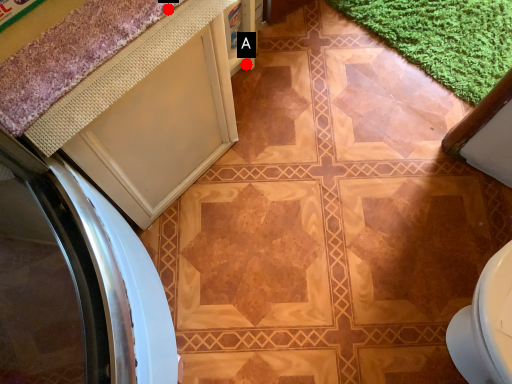
Question: Two points are circled on the image, labeled by A and B beside each circle. Which point appears farthest from the camera in this image?

Choices:
 (A) A is further
 (B) B is further

Answer: (A)